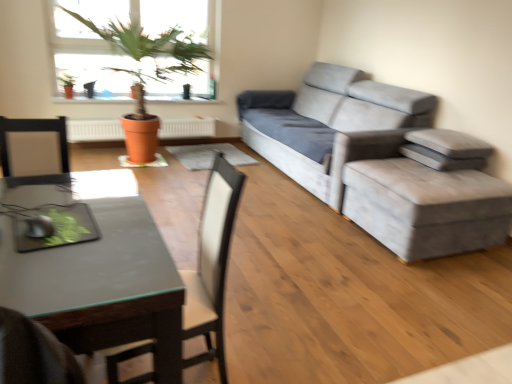
Question: Is black glass desk at lower left wider than velvet grey stool at right?

Choices:
 (A) yes
 (B) no

Answer: (B)

Question: Is black glass desk at lower left next to velvet grey stool at right?

Choices:
 (A) no
 (B) yes

Answer: (A)

Question: Is black glass desk at lower left oriented away from velvet grey stool at right?

Choices:
 (A) no
 (B) yes

Answer: (A)

Question: Are black glass desk at lower left and velvet grey stool at right far apart?

Choices:
 (A) no
 (B) yes

Answer: (B)

Question: Considering the relative sizes of black glass desk at lower left and velvet grey stool at right in the image provided, is black glass desk at lower left smaller than velvet grey stool at right?

Choices:
 (A) no
 (B) yes

Answer: (B)

Question: Based on their sizes in the image, would you say velvet grey stool at right is bigger or smaller than gray fabric pillow at right, placed as the 2th pillow when sorted from top to bottom?

Choices:
 (A) small
 (B) big

Answer: (B)

Question: Considering the positions of point (390, 240) and point (448, 165), is point (390, 240) closer or farther from the camera than point (448, 165)?

Choices:
 (A) closer
 (B) farther

Answer: (A)

Question: Considering the positions of velvet grey stool at right and gray fabric pillow at right, marked as the 1th pillow in a bottom-to-top arrangement, in the image, is velvet grey stool at right taller or shorter than gray fabric pillow at right, marked as the 1th pillow in a bottom-to-top arrangement,?

Choices:
 (A) short
 (B) tall

Answer: (B)

Question: Is velvet grey stool at right inside or outside of gray fabric pillow at right, placed as the 2th pillow when sorted from top to bottom?

Choices:
 (A) outside
 (B) inside

Answer: (A)

Question: Considering the positions of point (450, 152) and point (408, 238), is point (450, 152) closer or farther from the camera than point (408, 238)?

Choices:
 (A) closer
 (B) farther

Answer: (B)

Question: Considering their positions, is gray fabric pillow at right, which ranks as the 2th pillow in bottom-to-top order, located in front of or behind velvet grey stool at right?

Choices:
 (A) front
 (B) behind

Answer: (B)

Question: From the image's perspective, is gray fabric pillow at right, which ranks as the 1th pillow in top-to-bottom order, above or below velvet grey stool at right?

Choices:
 (A) below
 (B) above

Answer: (B)

Question: Is gray fabric pillow at right, which ranks as the 2th pillow in bottom-to-top order, taller or shorter than velvet grey stool at right?

Choices:
 (A) short
 (B) tall

Answer: (A)

Question: In terms of width, does terracotta clay pot at upper left look wider or thinner when compared to black leather swivel chair at center?

Choices:
 (A) thin
 (B) wide

Answer: (A)

Question: From the image's perspective, is terracotta clay pot at upper left above or below black leather swivel chair at center?

Choices:
 (A) below
 (B) above

Answer: (B)